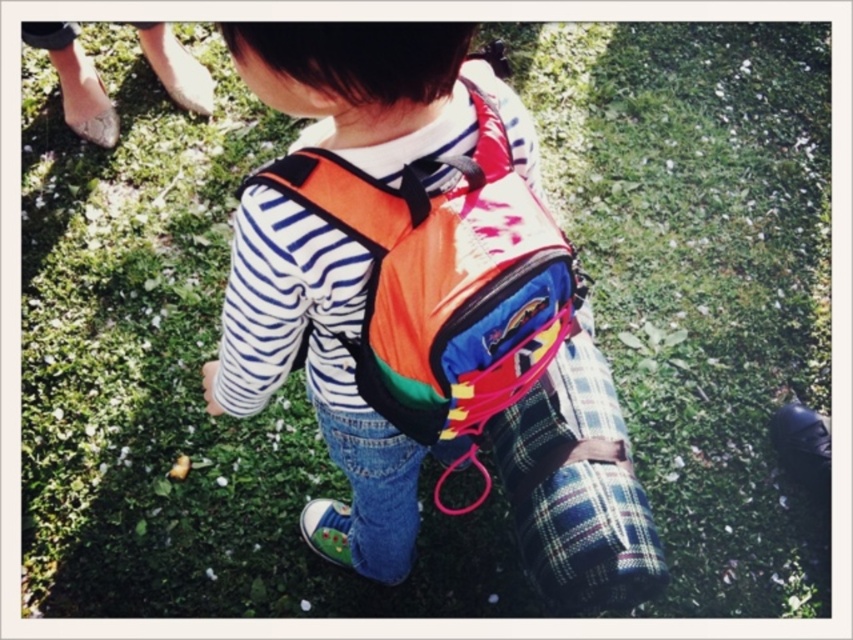
You are a delivery drone that needs to drop off a package to the child in the image. The package is 30 centimeters wide. Can you safely place the package between the matte orange backpack at center and the plaid fabric at center without it overlapping either item?

The distance between the matte orange backpack at center and the plaid fabric at center is 32.55 centimeters. Since the package is 30 centimeters wide, there is enough space to place it between them without overlapping either item.

You are navigating a path through the grassy area where the child is walking. There are two points marked on your map at coordinates point (372,392) and point (556,372). If you want to reach the point closer to the child, which coordinate should you head towards?

Point (372,392) is in front of point (556,372), so the closer point to the child would be point (372,392).